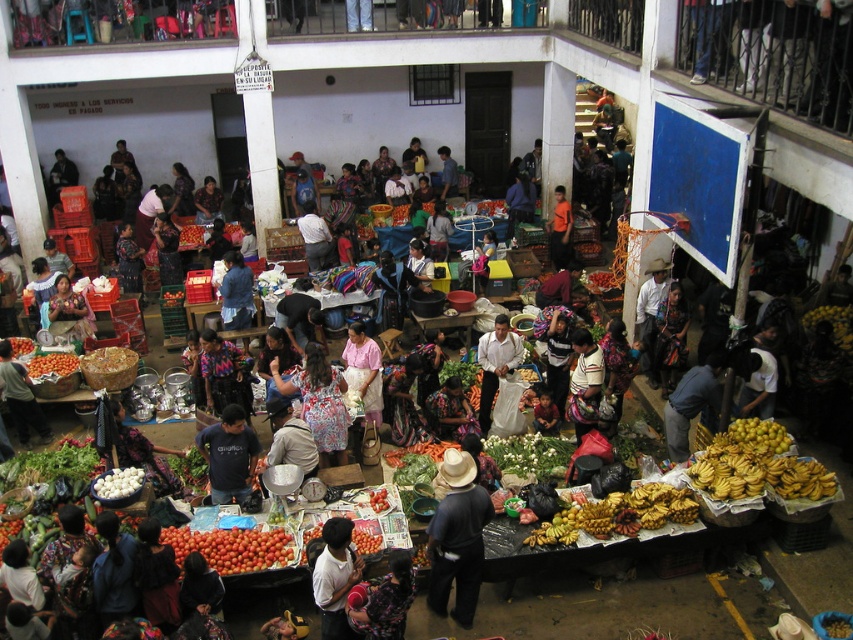
Question: Which point appears farthest from the camera in this image?

Choices:
 (A) (244, 390)
 (B) (231, 474)
 (C) (57, 369)
 (D) (556, 244)

Answer: (D)

Question: Does ripe red tomatoes at lower center appear on the right side of orange fabric shirt at center?

Choices:
 (A) no
 (B) yes

Answer: (A)

Question: Is white woven fabric at center positioned at the back of matte black shirt at lower left?

Choices:
 (A) yes
 (B) no

Answer: (B)

Question: Which is nearer to the white satin shirt at center?

Choices:
 (A) orange matte tomatoes at center
 (B) white matte shirt at center

Answer: (B)

Question: Can you confirm if white satin shirt at center is positioned to the left of orange matte tomatoes at center?

Choices:
 (A) no
 (B) yes

Answer: (A)

Question: Which object appears farthest from the camera in this image?

Choices:
 (A) denim jacket at center
 (B) white matte shirt at center

Answer: (A)